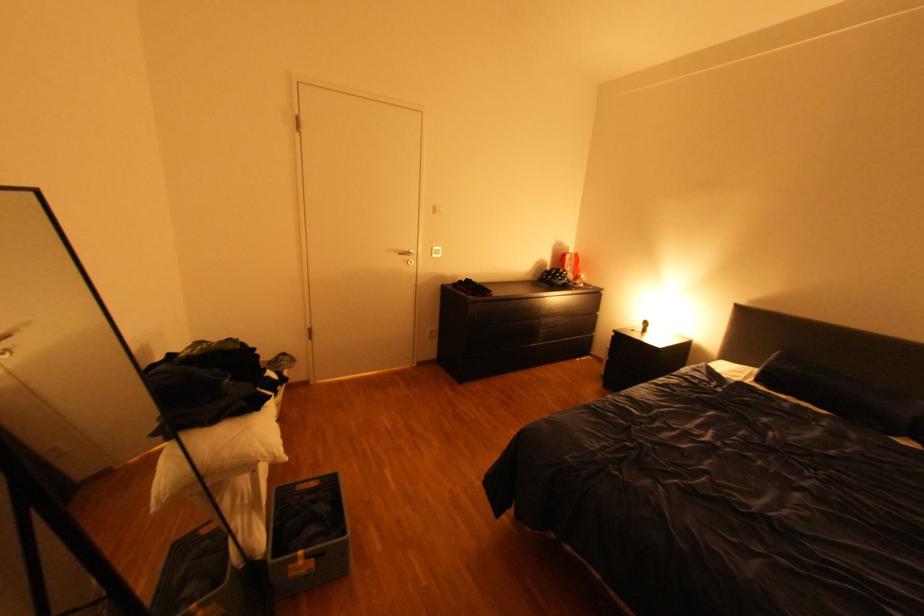
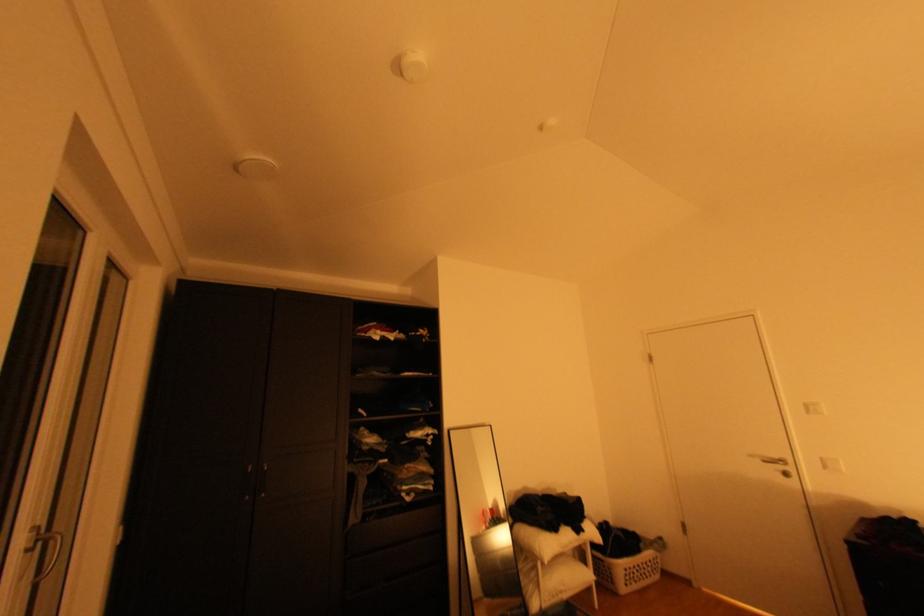
Find the pixel in the second image that matches point (417, 249) in the first image.

(786, 456)